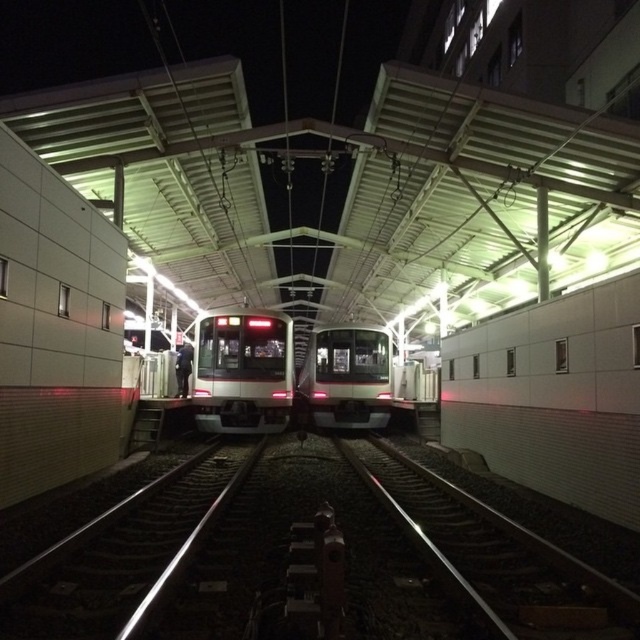
Is point (259, 403) in front of point (312, 406)?

Yes.

Which is more to the right, matte silver train at center or white glossy train at center?

white glossy train at center is more to the right.

Where is `matte silver train at center`? Image resolution: width=640 pixels, height=640 pixels. matte silver train at center is located at coordinates (243, 371).

Between point (467, 509) and point (252, 404), which one is positioned in front?

Point (467, 509) is more forward.

Is point (35, 563) positioned after point (241, 332)?

No, it is in front of (241, 332).

Is point (45, 609) positioned in front of point (288, 323)?

Yes, point (45, 609) is closer to viewer.

What are the coordinates of `metal/smooth track at center` in the screenshot? It's located at (307, 560).

Who is higher up, metal/smooth track at center or white glossy train at center?

white glossy train at center is higher up.

Which is more to the right, metal/smooth track at center or white glossy train at center?

white glossy train at center is more to the right.

Which is behind, point (301, 588) or point (300, 392)?

Point (300, 392)

This screenshot has width=640, height=640. I want to click on metal/smooth track at center, so click(x=307, y=560).